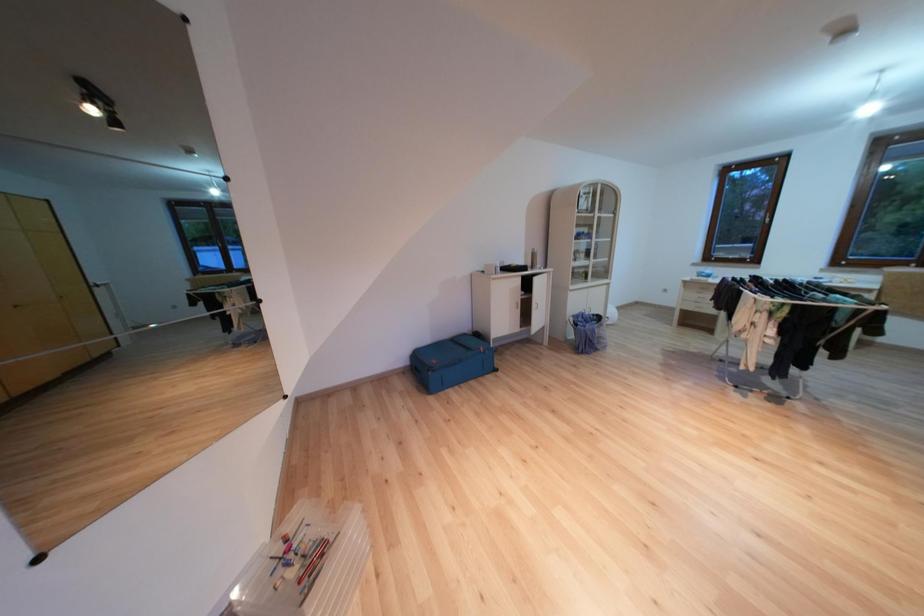
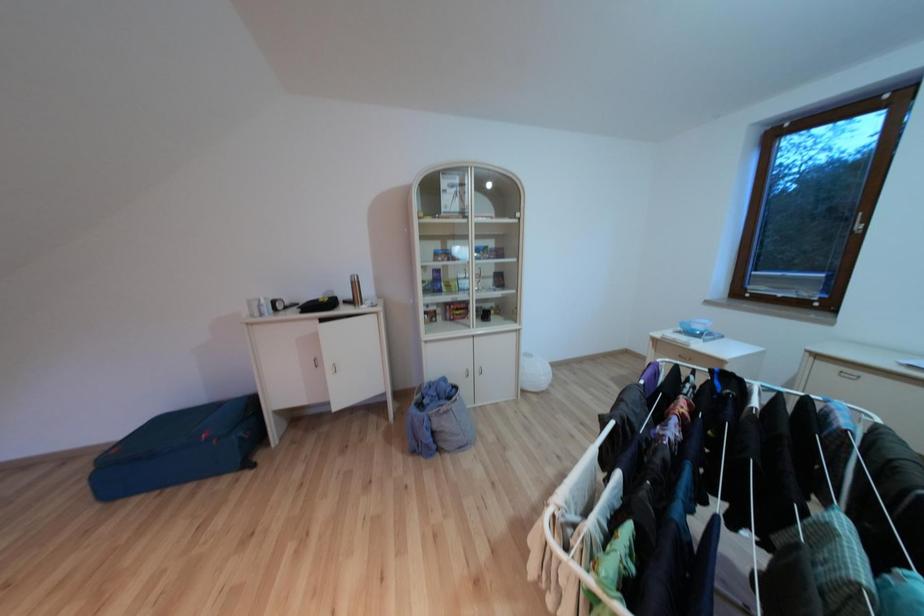
The images are taken continuously from a first-person perspective. In which direction are you moving?

The movement direction of the cameraman is right, forward.